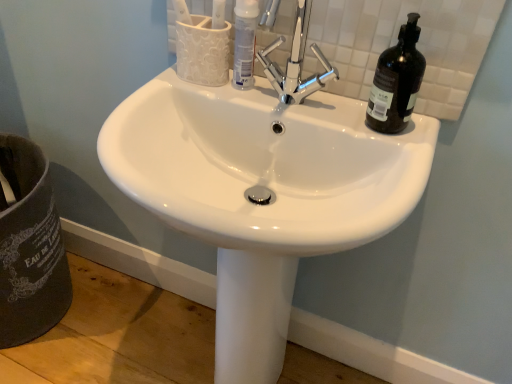
Identify the location of free space between black glass bottle at upper right and white glossy tube at center. (308, 94).